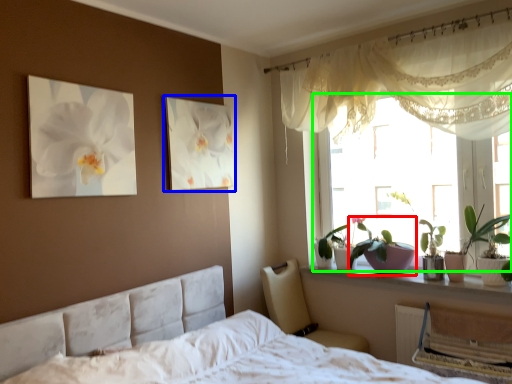
Question: Estimate the real-world distances between objects in this image. Which object is farther from plant (highlighted by a red box), picture frame (highlighted by a blue box) or window (highlighted by a green box)?

Choices:
 (A) picture frame
 (B) window

Answer: (A)